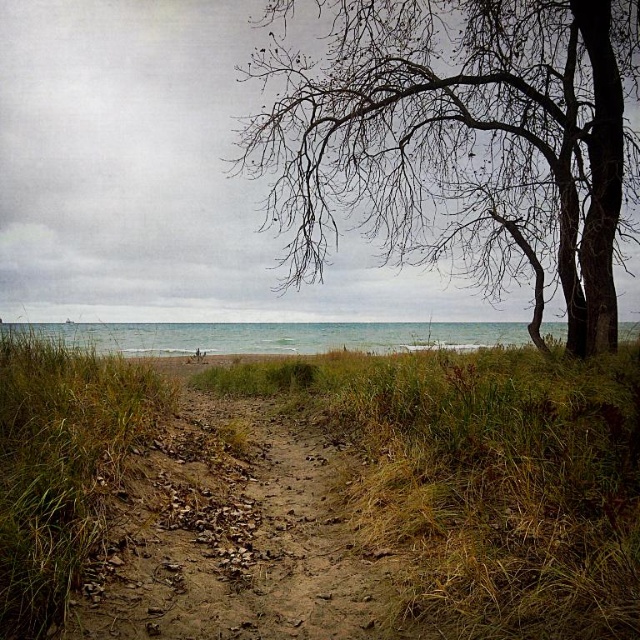
You are standing at the point closer to the camera in the image. Which point are you at, point [396,54] or point [189,397]?

You are at point [396,54] because it is closer to the camera than point [189,397].

You are a hiker who wants to take a photo of the bare branches at upper center and the green grass at center. Which object should you focus on first if you want to capture both in a single frame without moving the camera?

The bare branches at upper center is shorter than green grass at center, so you should focus on the green grass at center first to ensure both are in focus.

You are a hiker who wants to take a photo of the bare branches at upper center and the green grass at center. Which object will appear wider in the photo?

The green grass at center will appear wider in the photo because the bare branches at upper center has a lesser width compared to green grass at center.